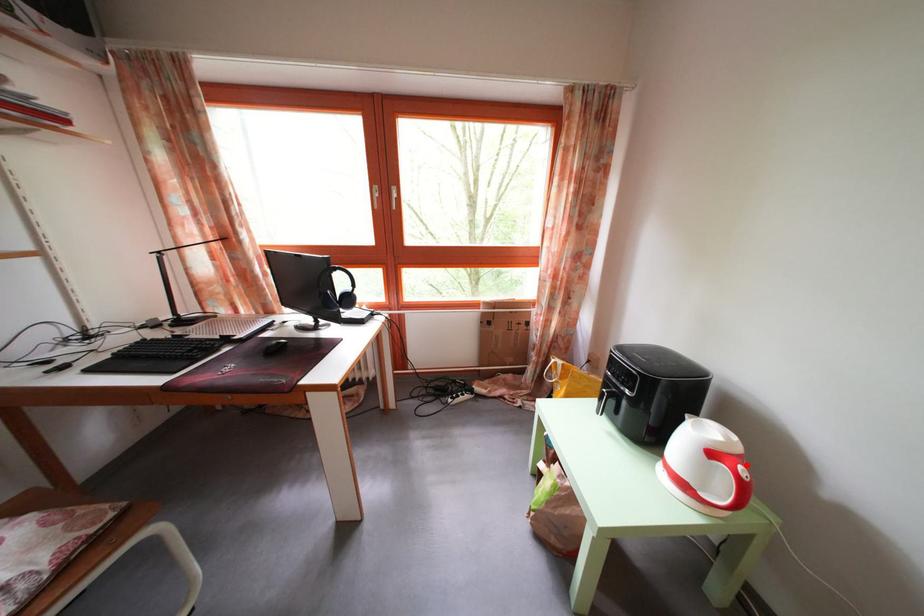
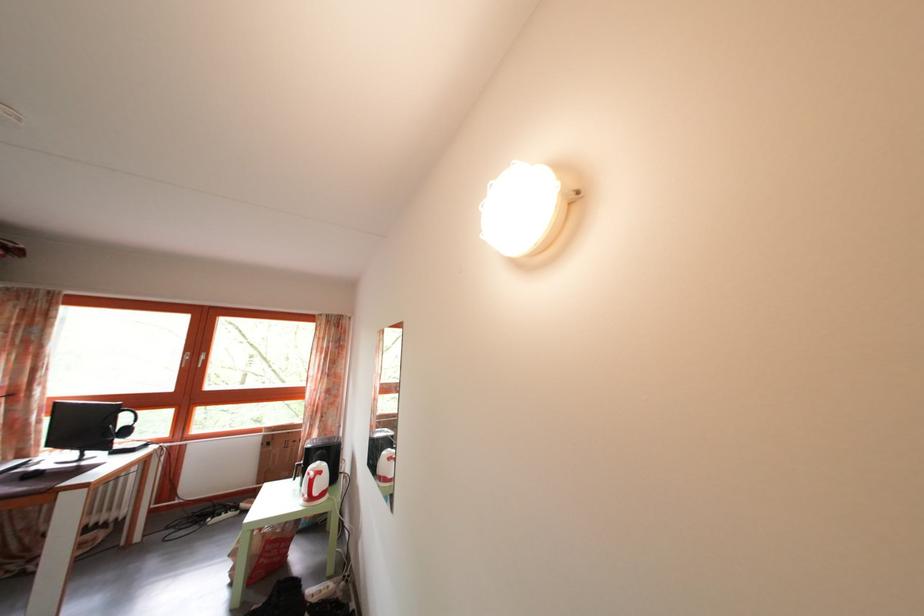
Question: A red point is marked in image1. In image2, is the corresponding 3D point closer to the camera or farther? Reply with the corresponding letter.

Choices:
 (A) The corresponding 3D point is closer.
 (B) The corresponding 3D point is farther.

Answer: (A)